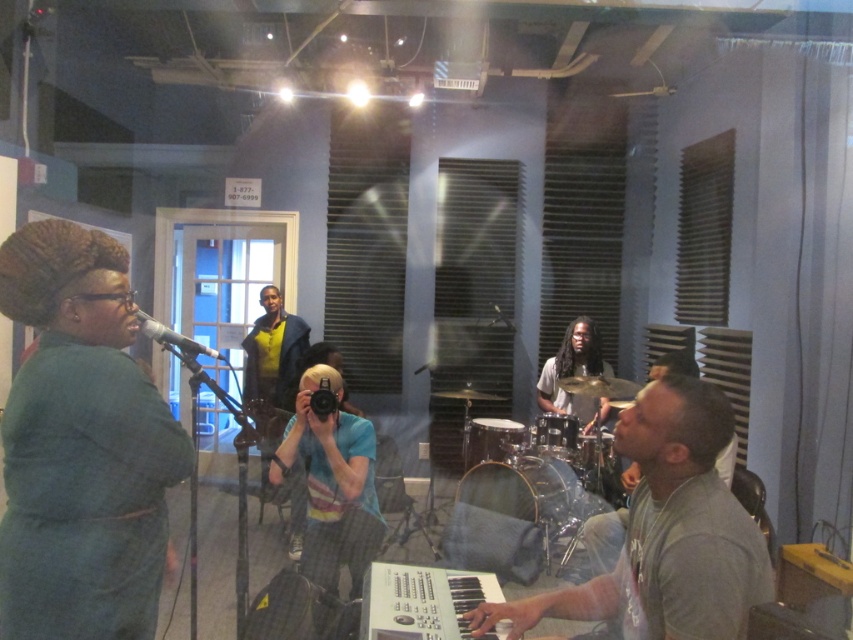
Who is positioned more to the left, black drum at center or shiny metallic drum at center?

From the viewer's perspective, black drum at center appears more on the left side.

Is point (548, 442) positioned behind point (604, 467)?

No, it is in front of (604, 467).

You are a GUI agent. You are given a task and a screenshot of the screen. Output one action in this format:
    pyautogui.click(x=<x>, y=<y>)
    Task: Click on the black drum at center
    This screenshot has height=640, width=853.
    Given the screenshot: What is the action you would take?
    pyautogui.click(x=556, y=435)

Can you confirm if shiny silver drum at center is wider than matte black microphone at left?

Indeed, shiny silver drum at center has a greater width compared to matte black microphone at left.

Does shiny silver drum at center appear on the left side of matte black microphone at left?

No, shiny silver drum at center is not to the left of matte black microphone at left.

The image size is (853, 640). In order to click on shiny silver drum at center in this screenshot , I will do `click(505, 518)`.

Who is lower down, black drum at center or black matte microphone at center?

black drum at center is below.

Is point (560, 449) positioned after point (514, 332)?

No, (560, 449) is closer to viewer.

Is point (544, 419) closer to viewer compared to point (498, 317)?

Yes, it is in front of point (498, 317).

Identify the location of black drum at center. The height and width of the screenshot is (640, 853). (556, 435).